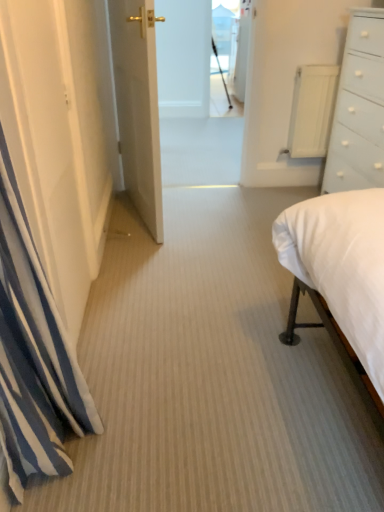
Question: Is transparent glass door at upper center bigger or smaller than white painted wood chest of drawers at right?

Choices:
 (A) small
 (B) big

Answer: (A)

Question: In terms of height, does transparent glass door at upper center look taller or shorter compared to white painted wood chest of drawers at right?

Choices:
 (A) tall
 (B) short

Answer: (A)

Question: Based on their relative distances, which object is nearer to the white painted wood chest of drawers at right?

Choices:
 (A) white glossy door at center
 (B) transparent glass door at upper center
 (C) white striped curtain at left

Answer: (A)

Question: Which of these objects is positioned closest to the white striped curtain at left?

Choices:
 (A) white painted wood chest of drawers at right
 (B) white glossy door at center
 (C) transparent glass door at upper center

Answer: (B)